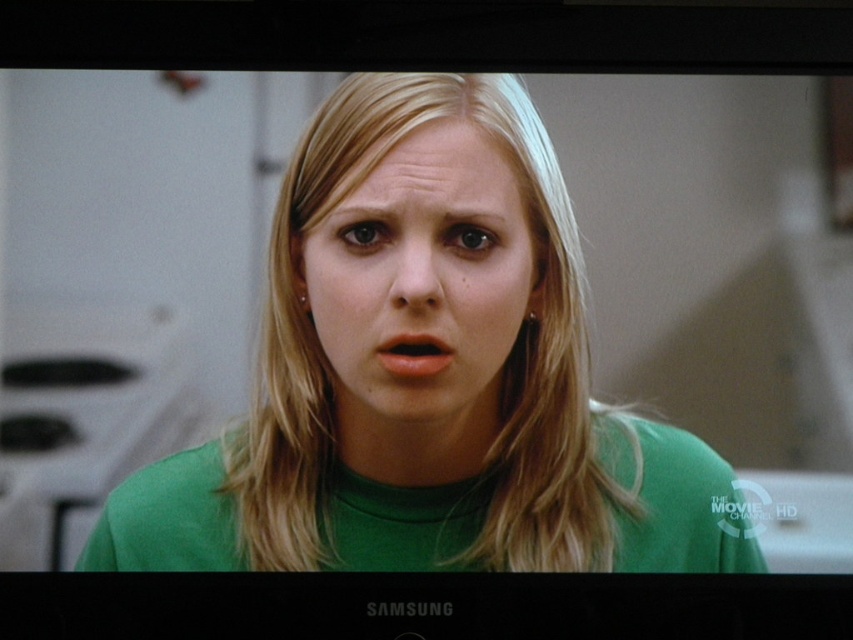
Measure the distance between point (305,296) and camera.

Point (305,296) and camera are 39.12 inches apart from each other.

Looking at this image, is the position of green matte shirt at center more distant than that of matte green face at center?

No, green matte shirt at center is in front of matte green face at center.

Describe the element at coordinates (427, 378) in the screenshot. The image size is (853, 640). I see `green matte shirt at center` at that location.

At what (x,y) coordinates should I click in order to perform the action: click on green matte shirt at center. Please return your answer as a coordinate pair (x, y). The image size is (853, 640). Looking at the image, I should click on click(x=427, y=378).

Who is lower down, matte green face at center or matte pink lips at center?

matte pink lips at center is below.

Which is in front, point (345, 307) or point (386, 358)?

Point (386, 358) is in front.

In order to click on matte green face at center in this screenshot , I will do `click(422, 280)`.

Who is positioned more to the left, green matte shirt at center or matte pink lips at center?

green matte shirt at center is more to the left.

Who is shorter, green matte shirt at center or matte pink lips at center?

matte pink lips at center is shorter.

This screenshot has width=853, height=640. In order to click on green matte shirt at center in this screenshot , I will do `click(427, 378)`.

Where is `green matte shirt at center`? The width and height of the screenshot is (853, 640). green matte shirt at center is located at coordinates (427, 378).